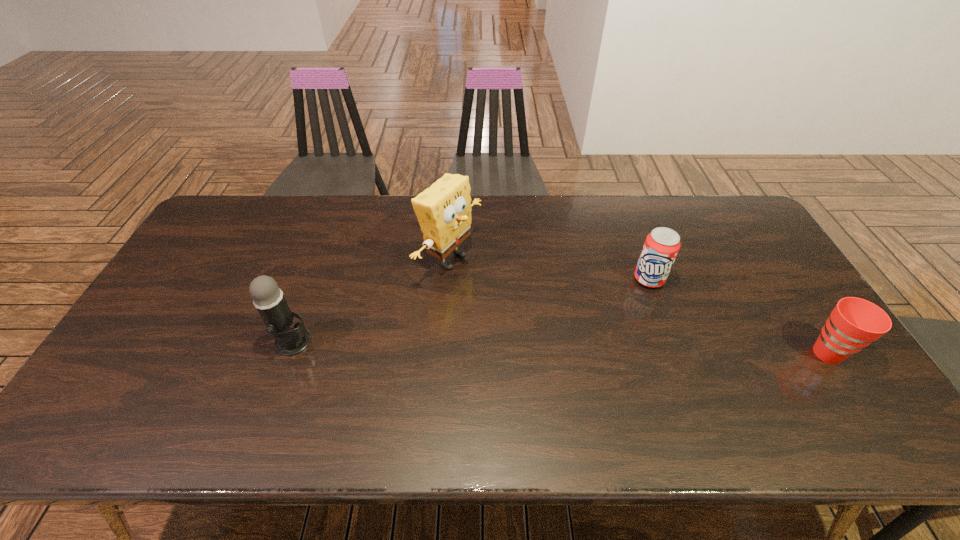
You are a GUI agent. You are given a task and a screenshot of the screen. Output one action in this format:
    pyautogui.click(x=<x>, y=<y>)
    Task: Click on the vacant region at the far left corner of the desktop
    
    Given the screenshot: What is the action you would take?
    pyautogui.click(x=246, y=210)

The image size is (960, 540). I want to click on vacant space at the near left corner of the desktop, so click(104, 402).

Where is `vacant region at the far right corner of the desktop`? vacant region at the far right corner of the desktop is located at coordinates (714, 213).

You are a GUI agent. You are given a task and a screenshot of the screen. Output one action in this format:
    pyautogui.click(x=<x>, y=<y>)
    Task: Click on the vacant space that's between the rightmost object and the soda can
    The width and height of the screenshot is (960, 540).
    Given the screenshot: What is the action you would take?
    pyautogui.click(x=738, y=316)

This screenshot has height=540, width=960. I want to click on free point between the sponge and the microphone, so coord(372,301).

This screenshot has width=960, height=540. Identify the location of free area in between the microphone and the cup. (561, 348).

Where is `empty location between the rightmost object and the microphone`? Image resolution: width=960 pixels, height=540 pixels. empty location between the rightmost object and the microphone is located at coordinates (561, 348).

Image resolution: width=960 pixels, height=540 pixels. I want to click on vacant space that's between the microphone and the sponge, so click(x=372, y=301).

Find the location of `free spot between the sponge and the cup`. free spot between the sponge and the cup is located at coordinates (638, 306).

Where is `free spot between the sponge and the soda can`? The image size is (960, 540). free spot between the sponge and the soda can is located at coordinates (549, 269).